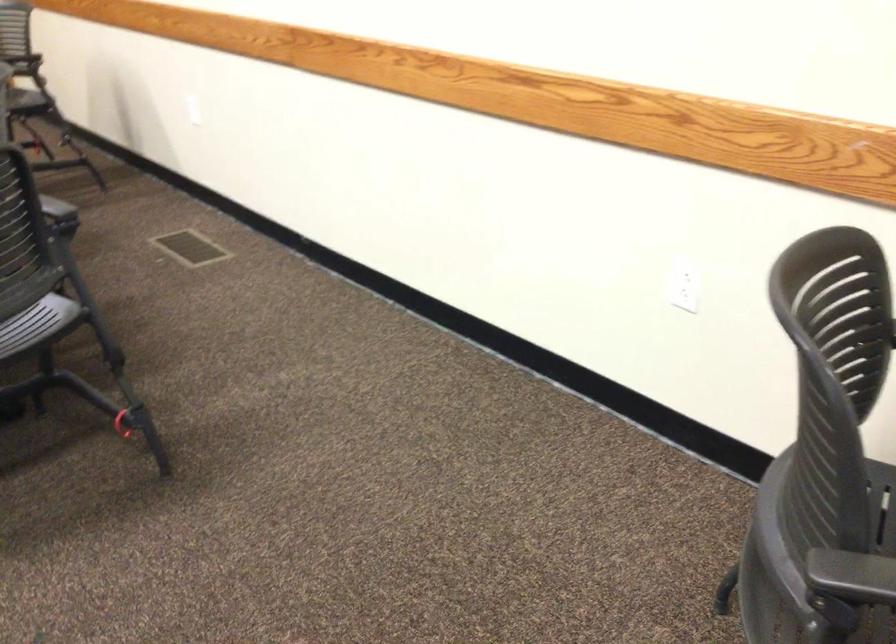
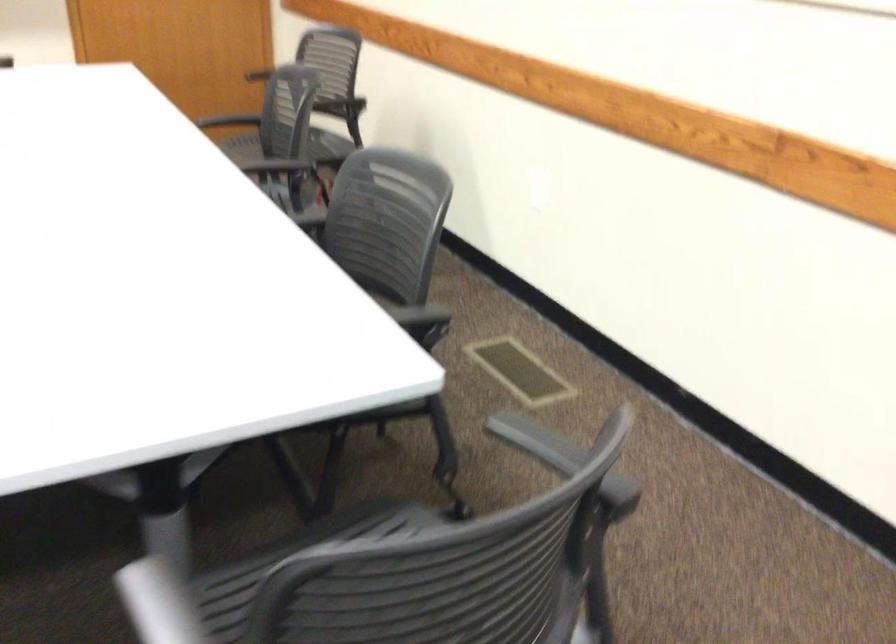
The images are taken continuously from a first-person perspective. In which direction are you moving?

The movement direction of the cameraman is left, forward.